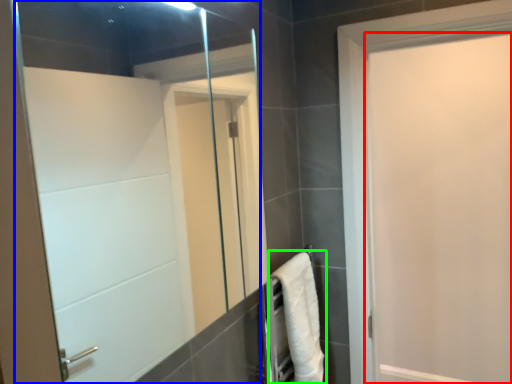
Question: Which object is the closest to the door (highlighted by a red box)? Choose among these: mirror (highlighted by a blue box) or bath towel (highlighted by a green box).

Choices:
 (A) mirror
 (B) bath towel

Answer: (B)